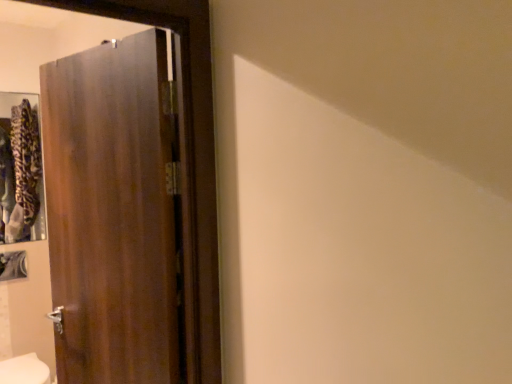
Question: In the image, is dark wood door at left on the left side or the right side of white glossy bidet at lower left?

Choices:
 (A) left
 (B) right

Answer: (B)

Question: From the image's perspective, is dark wood door at left located above or below white glossy bidet at lower left?

Choices:
 (A) above
 (B) below

Answer: (A)

Question: In terms of height, does dark wood door at left look taller or shorter compared to white glossy bidet at lower left?

Choices:
 (A) short
 (B) tall

Answer: (B)

Question: From a real-world perspective, is white glossy bidet at lower left physically located above or below dark wood door at left?

Choices:
 (A) below
 (B) above

Answer: (A)

Question: Is white glossy bidet at lower left to the left or to the right of dark wood door at left in the image?

Choices:
 (A) right
 (B) left

Answer: (B)

Question: Is white glossy bidet at lower left inside the boundaries of dark wood door at left, or outside?

Choices:
 (A) outside
 (B) inside

Answer: (A)

Question: Is white glossy bidet at lower left taller or shorter than dark wood door at left?

Choices:
 (A) short
 (B) tall

Answer: (A)